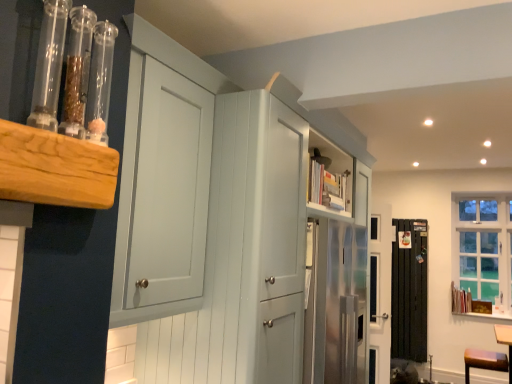
Where is `brown wood vanity at lower right`? brown wood vanity at lower right is located at coordinates (484, 361).

The image size is (512, 384). Describe the element at coordinates (483, 248) in the screenshot. I see `clear glass window at upper right` at that location.

In order to face black metal radiator at lower right, should I rotate leftwards or rightwards?

Turn right by 19.806 degrees to look at black metal radiator at lower right.

What do you see at coordinates (409, 292) in the screenshot? I see `black metal radiator at lower right` at bounding box center [409, 292].

Where is `matte white cabinet at upper center`? The width and height of the screenshot is (512, 384). matte white cabinet at upper center is located at coordinates (245, 255).

What do you see at coordinates (18, 56) in the screenshot? This screenshot has height=384, width=512. I see `transparent glass tubes at upper left` at bounding box center [18, 56].

In order to click on brown wood vanity at lower right in this screenshot , I will do `click(484, 361)`.

Does transparent glass tubes at upper left come behind black metal radiator at lower right?

No, transparent glass tubes at upper left is in front of black metal radiator at lower right.

Would you consider transparent glass tubes at upper left to be distant from black metal radiator at lower right?

That's right, there is a large distance between transparent glass tubes at upper left and black metal radiator at lower right.

Considering the relative sizes of transparent glass tubes at upper left and black metal radiator at lower right in the image provided, is transparent glass tubes at upper left smaller than black metal radiator at lower right?

Yes.

Identify the location of shelf above the matte white cabinet at upper center (from a real-world perspective). (18, 56).

How distant is matte white cabinet at upper center from transparent glass tubes at upper left?

matte white cabinet at upper center and transparent glass tubes at upper left are 33.27 inches apart from each other.

Considering the relative positions of matte white cabinet at upper center and transparent glass tubes at upper left in the image provided, is matte white cabinet at upper center to the left or to the right of transparent glass tubes at upper left?

matte white cabinet at upper center is positioned on transparent glass tubes at upper left's right side.

Looking at their sizes, would you say matte white cabinet at upper center is wider or thinner than transparent glass tubes at upper left?

In the image, matte white cabinet at upper center appears to be wider than transparent glass tubes at upper left.

In the image, is black metal radiator at lower right on the left side or the right side of clear glass window at upper right?

black metal radiator at lower right is to the left of clear glass window at upper right.

From a real-world perspective, does black metal radiator at lower right sit lower than clear glass window at upper right?

Yes, from a real-world perspective, black metal radiator at lower right is beneath clear glass window at upper right.

Locate an element on the screen. screen door lying below the clear glass window at upper right (from the image's perspective) is located at coordinates (409, 292).

Can you tell me how much black metal radiator at lower right and clear glass window at upper right differ in facing direction?

There is a 151-degree angle between the facing directions of black metal radiator at lower right and clear glass window at upper right.

Is matte white cabinet at upper center outside of black metal radiator at lower right?

That's correct, matte white cabinet at upper center is outside of black metal radiator at lower right.

Which is closer to the camera, (241, 260) or (405, 313)?

The point (241, 260) is closer.

Is matte white cabinet at upper center bigger than black metal radiator at lower right?

Indeed, matte white cabinet at upper center has a larger size compared to black metal radiator at lower right.

Can you tell me how much matte white cabinet at upper center and black metal radiator at lower right differ in facing direction?

There is a 60.3-degree angle between the facing directions of matte white cabinet at upper center and black metal radiator at lower right.

Is black metal radiator at lower right completely or partially outside of brown wood vanity at lower right?

Absolutely, black metal radiator at lower right is external to brown wood vanity at lower right.

From the picture: From their relative heights in the image, would you say black metal radiator at lower right is taller or shorter than brown wood vanity at lower right?

black metal radiator at lower right is taller than brown wood vanity at lower right.

From a real-world perspective, is black metal radiator at lower right positioned above or below brown wood vanity at lower right?

From a real-world perspective, black metal radiator at lower right is physically above brown wood vanity at lower right.

How different are the orientations of black metal radiator at lower right and brown wood vanity at lower right in degrees?

The angular difference between black metal radiator at lower right and brown wood vanity at lower right is 61.6 degrees.

From a real-world perspective, relative to clear glass window at upper right, is matte white cabinet at upper center vertically above or below?

Clearly, from a real-world perspective, matte white cabinet at upper center is below clear glass window at upper right.

Between matte white cabinet at upper center and clear glass window at upper right, which one has less height?

clear glass window at upper right.

Does matte white cabinet at upper center appear on the right side of clear glass window at upper right?

In fact, matte white cabinet at upper center is to the left of clear glass window at upper right.

Locate an element on the screen. The height and width of the screenshot is (384, 512). screen door behind the matte white cabinet at upper center is located at coordinates (409, 292).

In terms of size, does black metal radiator at lower right appear bigger or smaller than matte white cabinet at upper center?

In the image, black metal radiator at lower right appears to be smaller than matte white cabinet at upper center.

Would you say black metal radiator at lower right is a long distance from matte white cabinet at upper center?

Yes.

From the image's perspective, which one is positioned lower, black metal radiator at lower right or matte white cabinet at upper center?

black metal radiator at lower right is shown below in the image.

Where is `screen door behind the transparent glass tubes at upper left`? The height and width of the screenshot is (384, 512). screen door behind the transparent glass tubes at upper left is located at coordinates (409, 292).

You are a GUI agent. You are given a task and a screenshot of the screen. Output one action in this format:
    pyautogui.click(x=<x>, y=<y>)
    Task: Click on the dresser below the transparent glass tubes at upper left (from the image's perspective)
    The image size is (512, 384).
    Given the screenshot: What is the action you would take?
    coord(245,255)

Which object lies nearer to the anchor point black metal radiator at lower right, brown wood vanity at lower right or clear glass window at upper right?

The object closer to black metal radiator at lower right is clear glass window at upper right.

From the image, which object appears to be nearer to brown wood vanity at lower right, clear glass window at upper right or transparent glass tubes at upper left?

clear glass window at upper right.

Based on their spatial positions, is transparent glass tubes at upper left or brown wood vanity at lower right closer to matte white cabinet at upper center?

Based on the image, transparent glass tubes at upper left appears to be nearer to matte white cabinet at upper center.

Considering their positions, is transparent glass tubes at upper left positioned further to clear glass window at upper right than brown wood vanity at lower right?

transparent glass tubes at upper left.

Considering their positions, is brown wood vanity at lower right positioned closer to transparent glass tubes at upper left than clear glass window at upper right?

Among the two, brown wood vanity at lower right is located nearer to transparent glass tubes at upper left.

Looking at the image, which one is located further to clear glass window at upper right, brown wood vanity at lower right or transparent glass tubes at upper left?

transparent glass tubes at upper left is further to clear glass window at upper right.

Estimate the real-world distances between objects in this image. Which object is further from black metal radiator at lower right, matte white cabinet at upper center or brown wood vanity at lower right?

The object further to black metal radiator at lower right is matte white cabinet at upper center.

Based on their spatial positions, is brown wood vanity at lower right or black metal radiator at lower right further from matte white cabinet at upper center?

black metal radiator at lower right lies further to matte white cabinet at upper center than the other object.

Identify the location of dresser between transparent glass tubes at upper left and clear glass window at upper right along the z-axis. (245, 255).

Find the location of `dresser between transparent glass tubes at upper left and brown wood vanity at lower right along the z-axis`. dresser between transparent glass tubes at upper left and brown wood vanity at lower right along the z-axis is located at coordinates pos(245,255).

Where is `vanity between transparent glass tubes at upper left and black metal radiator at lower right along the z-axis`? This screenshot has width=512, height=384. vanity between transparent glass tubes at upper left and black metal radiator at lower right along the z-axis is located at coordinates (484, 361).

The height and width of the screenshot is (384, 512). I want to click on vanity positioned between transparent glass tubes at upper left and clear glass window at upper right from near to far, so click(x=484, y=361).